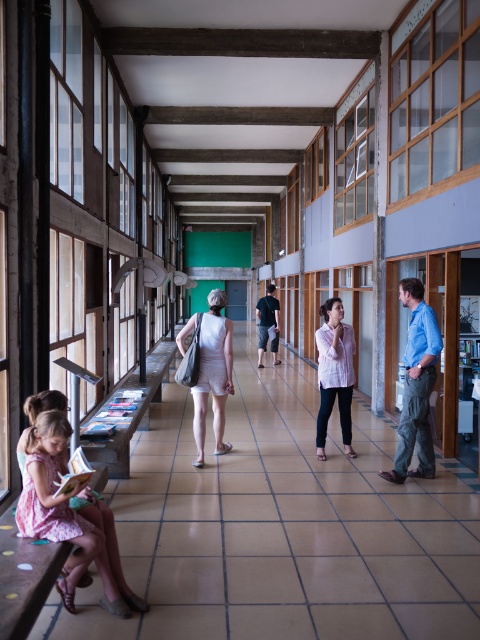
You are standing in the corridor and want to greet the person wearing the pink fabric dress at lower left first before greeting the person in the blue cotton shirt at right. Which person should you approach first?

You should approach the person wearing the pink fabric dress at lower left first because they are closer to you than the blue cotton shirt at right, which is further away.